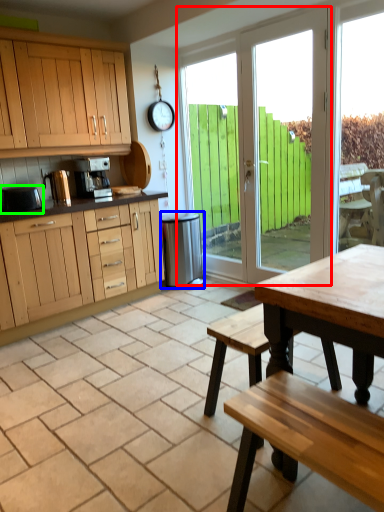
Question: Which is nearer to the door (highlighted by a red box)? appliance (highlighted by a blue box) or appliance (highlighted by a green box).

Choices:
 (A) appliance
 (B) appliance

Answer: (A)